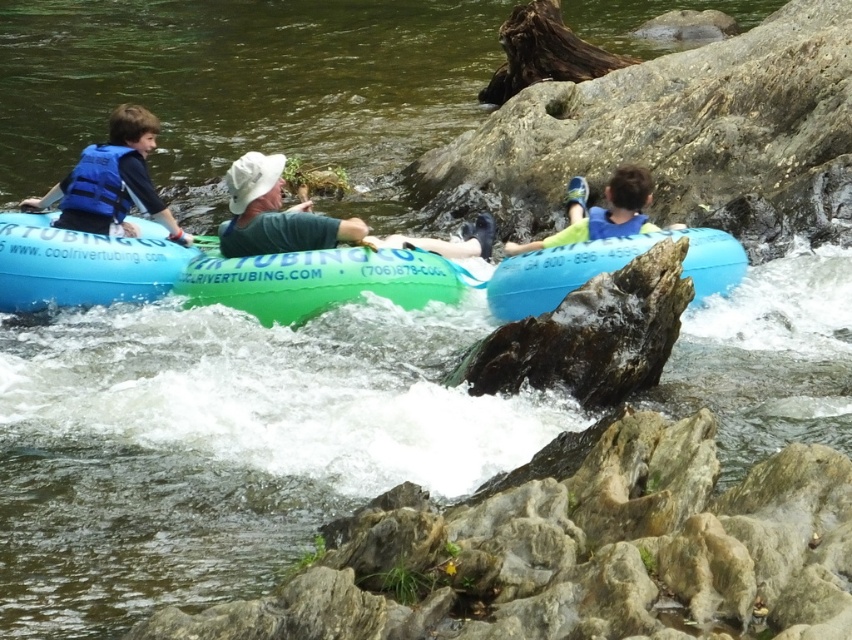
Question: Does green rubber raft at center appear under blue life vest at left?

Choices:
 (A) no
 (B) yes

Answer: (B)

Question: Which point is farther to the camera?

Choices:
 (A) (573, 253)
 (B) (112, 172)
 (C) (583, 195)

Answer: (C)

Question: Is green fabric life vest at center positioned in front of blue fabric life jacket at left?

Choices:
 (A) no
 (B) yes

Answer: (A)

Question: Which of the following is the farthest from the observer?

Choices:
 (A) blue life vest at left
 (B) matte blue tube at left
 (C) blue rubber tube at center

Answer: (A)

Question: Observing the image, what is the correct spatial positioning of green fabric life vest at center in reference to blue fabric life jacket at left?

Choices:
 (A) below
 (B) above

Answer: (A)

Question: Among these points, which one is farthest from the camera?

Choices:
 (A) (117, 180)
 (B) (704, 269)
 (C) (311, 236)
 (D) (651, 188)

Answer: (A)